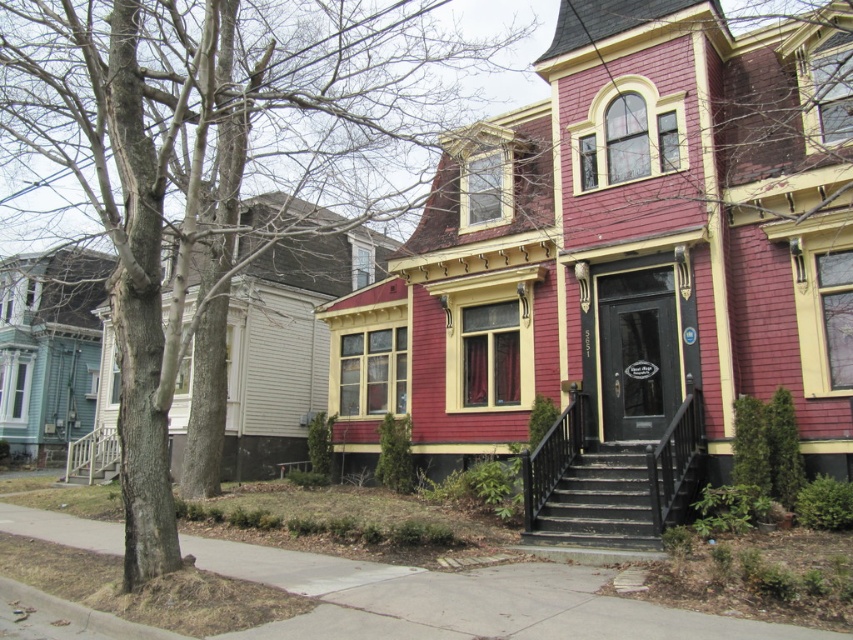
Is concrete sidewalk at lower center bigger than black wooden stairs at center?

Indeed, concrete sidewalk at lower center has a larger size compared to black wooden stairs at center.

Does concrete sidewalk at lower center have a lesser width compared to black wooden stairs at center?

In fact, concrete sidewalk at lower center might be wider than black wooden stairs at center.

Measure the distance between concrete sidewalk at lower center and camera.

They are 6.03 meters apart.

The height and width of the screenshot is (640, 853). What are the coordinates of `concrete sidewalk at lower center` in the screenshot? It's located at (463, 600).

Between point (339, 45) and point (604, 525), which one is positioned behind?

Positioned behind is point (339, 45).

Does brown bark tree at left have a lesser height compared to black wooden stairs at center?

Incorrect, brown bark tree at left's height does not fall short of black wooden stairs at center's.

Find the location of a particular element. This screenshot has height=640, width=853. brown bark tree at left is located at coordinates (212, 164).

Image resolution: width=853 pixels, height=640 pixels. I want to click on brown bark tree at left, so click(212, 164).

Does brown bark tree at left have a greater width compared to concrete sidewalk at lower center?

Correct, the width of brown bark tree at left exceeds that of concrete sidewalk at lower center.

This screenshot has width=853, height=640. What do you see at coordinates (212, 164) in the screenshot?
I see `brown bark tree at left` at bounding box center [212, 164].

I want to click on brown bark tree at left, so click(x=212, y=164).